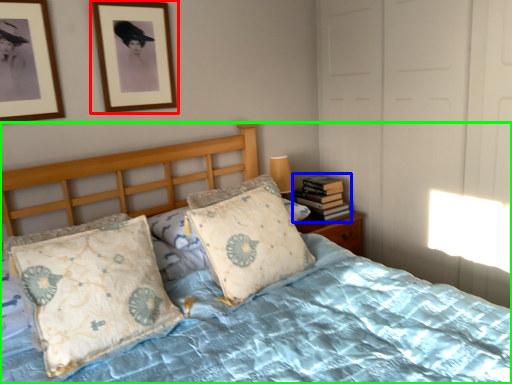
Question: Which object is positioned closest to picture frame (highlighted by a red box)? Select from book (highlighted by a blue box) and bed (highlighted by a green box).

Choices:
 (A) book
 (B) bed

Answer: (A)